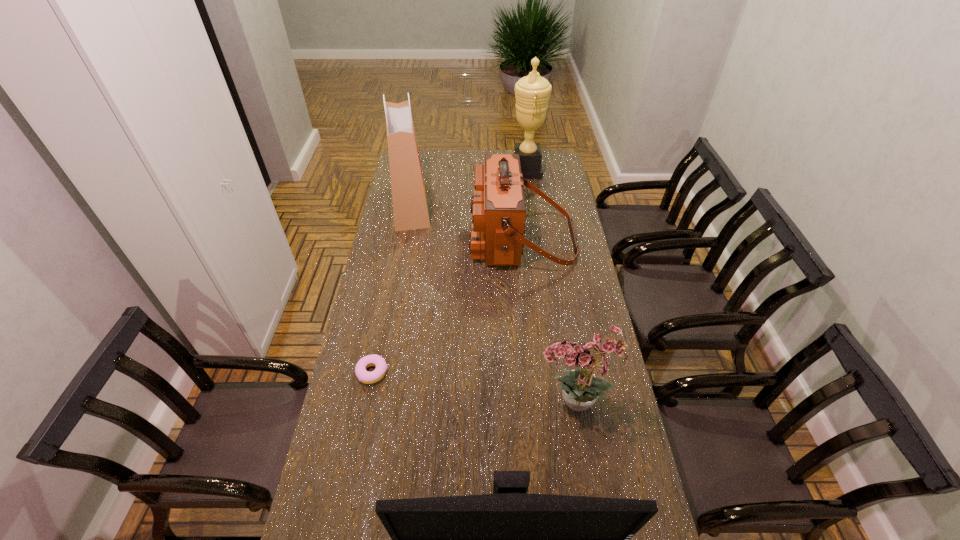
Where is `vacant area that lies between the satchel and the shopping bag`? This screenshot has height=540, width=960. vacant area that lies between the satchel and the shopping bag is located at coordinates (467, 222).

At what (x,y) coordinates should I click in order to perform the action: click on empty space between the satchel and the shopping bag. Please return your answer as a coordinate pair (x, y). The height and width of the screenshot is (540, 960). Looking at the image, I should click on (467, 222).

Locate an element on the screen. This screenshot has width=960, height=540. object that is the third closest to the shopping bag is located at coordinates (362, 374).

Locate an element on the screen. object that ranks as the fifth closest to the shopping bag is located at coordinates (511, 539).